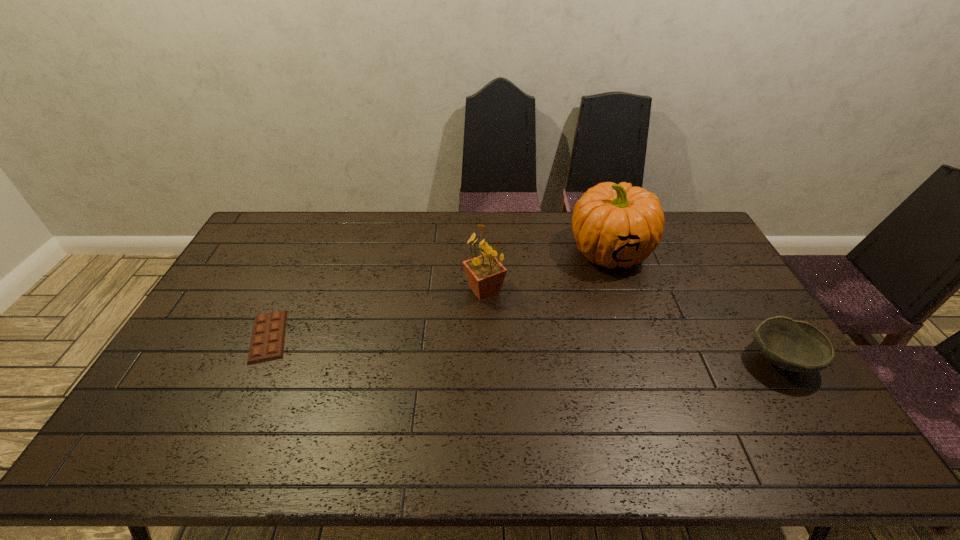
The image size is (960, 540). In order to click on blank space located on the surface of the second object from right to left in this screenshot , I will do `click(562, 289)`.

Find the location of `vacant area situated 0.320m at the front of the second object from left to right with flowers visible`. vacant area situated 0.320m at the front of the second object from left to right with flowers visible is located at coordinates (444, 388).

Identify the location of vacant space located 0.200m at the front of the second object from left to right with flowers visible. coord(459,354).

You are a GUI agent. You are given a task and a screenshot of the screen. Output one action in this format:
    pyautogui.click(x=<x>, y=<y>)
    Task: Click on the vacant position located 0.340m at the front of the second object from left to right with flowers visible
    The image size is (960, 540).
    Given the screenshot: What is the action you would take?
    pyautogui.click(x=443, y=395)

This screenshot has width=960, height=540. Identify the location of object located at the far edge. (613, 224).

The height and width of the screenshot is (540, 960). I want to click on object that is at the near edge, so click(x=792, y=345).

Locate an element on the screen. The image size is (960, 540). object present at the right edge is located at coordinates (792, 345).

What are the coordinates of `object that is at the near right corner` in the screenshot? It's located at (792, 345).

The width and height of the screenshot is (960, 540). In order to click on vacant space at the far edge in this screenshot , I will do `click(346, 216)`.

At what (x,y) coordinates should I click in order to perform the action: click on free space at the near edge of the desktop. Please return your answer as a coordinate pair (x, y). Looking at the image, I should click on (376, 402).